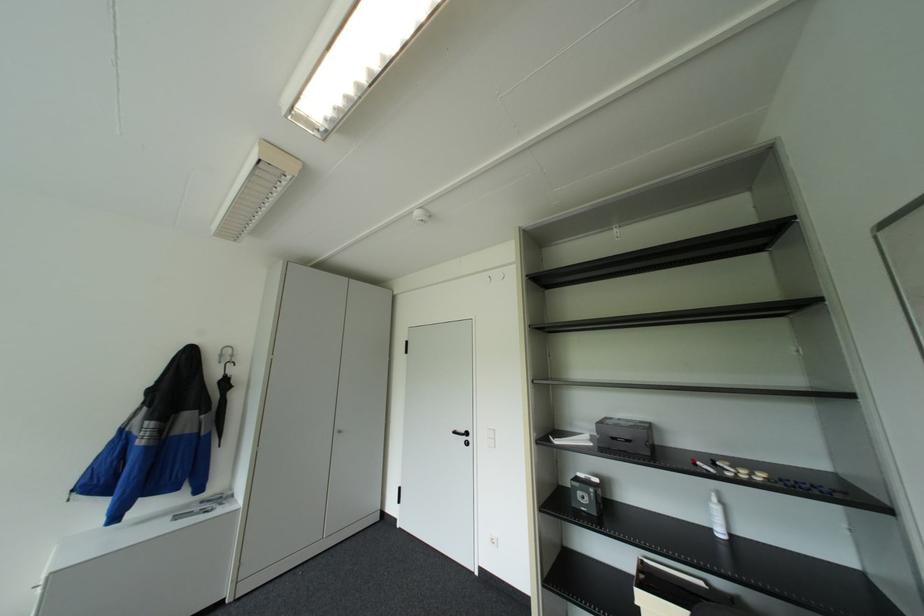
Where is `black door handle`? black door handle is located at coordinates (459, 435).